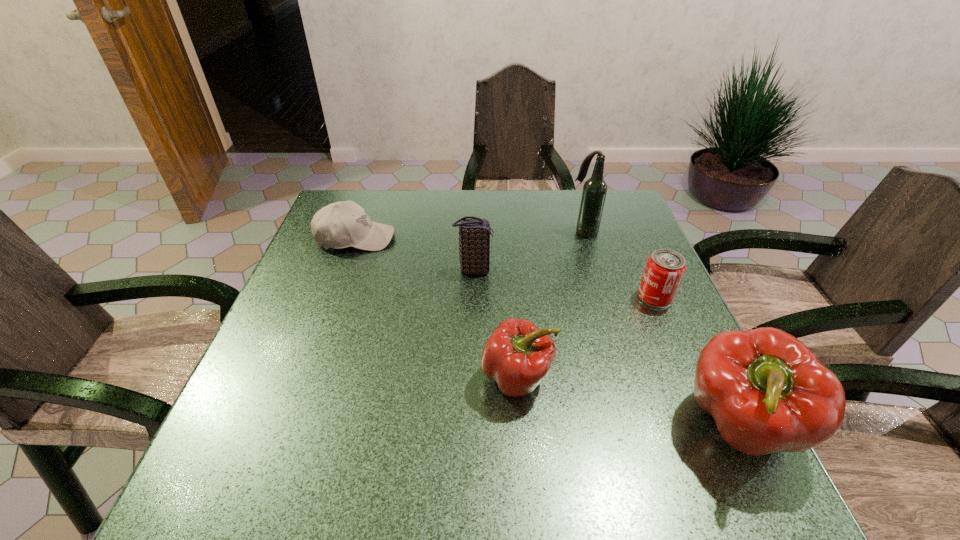
Where is `unoccupied position between the clutch bag and the baseball cap`? unoccupied position between the clutch bag and the baseball cap is located at coordinates (415, 254).

Locate an element on the screen. This screenshot has width=960, height=540. unoccupied position between the baseball cap and the third farthest object is located at coordinates (415, 254).

Locate an element on the screen. This screenshot has height=540, width=960. blank region between the leftmost object and the third nearest object is located at coordinates (505, 268).

Where is `vacant area that lies between the can and the leftmost object`? This screenshot has width=960, height=540. vacant area that lies between the can and the leftmost object is located at coordinates (505, 268).

What are the coordinates of `free space between the baseball cap and the third farthest object` in the screenshot? It's located at (415, 254).

This screenshot has width=960, height=540. What are the coordinates of `vacant area that lies between the right pepper and the fourth object from left to right` in the screenshot? It's located at (661, 329).

This screenshot has height=540, width=960. I want to click on blank region between the taller pepper and the fourth farthest object, so click(x=697, y=362).

Locate an element on the screen. This screenshot has width=960, height=540. empty location between the fourth nearest object and the third object from right to left is located at coordinates click(x=528, y=251).

Where is `vacant region between the shorter pepper and the tallest object`? vacant region between the shorter pepper and the tallest object is located at coordinates (550, 305).

Where is `object that is the third closest to the fourth farthest object`? object that is the third closest to the fourth farthest object is located at coordinates pyautogui.click(x=517, y=355).